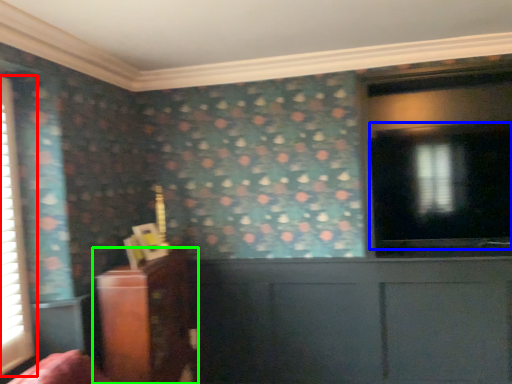
Question: Which object is positioned closest to window (highlighted by a red box)? Select from window screen (highlighted by a blue box) and furniture (highlighted by a green box).

Choices:
 (A) window screen
 (B) furniture

Answer: (B)